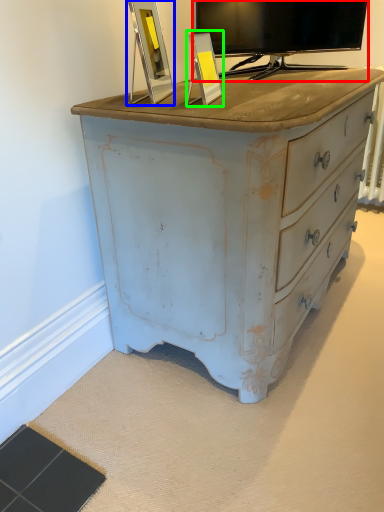
Question: Which object is the closest to the television (highlighted by a red box)? Choose among these: picture frame (highlighted by a blue box) or picture frame (highlighted by a green box).

Choices:
 (A) picture frame
 (B) picture frame

Answer: (A)